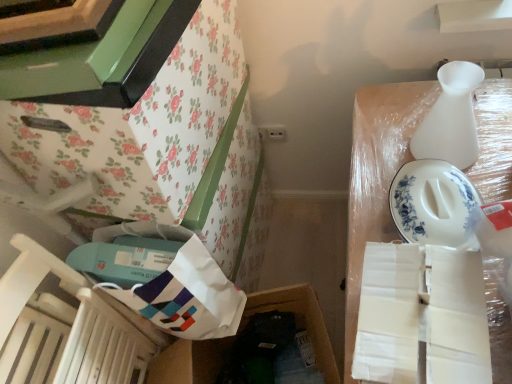
Question: Is white paper bag at lower left, which is counted as the 1th storage box, starting from the left, at the right side of floral paper-covered cabinet at upper left?

Choices:
 (A) yes
 (B) no

Answer: (A)

Question: Is floral paper-covered cabinet at upper left at the back of white paper bag at lower left, which is counted as the 1th storage box, starting from the left?

Choices:
 (A) yes
 (B) no

Answer: (B)

Question: Is white paper bag at lower left, the 2th storage box positioned from the right, not inside floral paper-covered cabinet at upper left?

Choices:
 (A) yes
 (B) no

Answer: (A)

Question: From a real-world perspective, is white paper bag at lower left, which is counted as the 1th storage box, starting from the left, on floral paper-covered cabinet at upper left?

Choices:
 (A) no
 (B) yes

Answer: (A)

Question: Is white paper bag at lower left, which is counted as the 1th storage box, starting from the left, far away from floral paper-covered cabinet at upper left?

Choices:
 (A) no
 (B) yes

Answer: (A)

Question: Can you confirm if white paper bag at lower left, which is counted as the 1th storage box, starting from the left, is thinner than floral paper-covered cabinet at upper left?

Choices:
 (A) yes
 (B) no

Answer: (B)

Question: Does wooden chair at lower left have a greater height compared to white matte vase at upper right?

Choices:
 (A) yes
 (B) no

Answer: (A)

Question: Is wooden chair at lower left smaller than white matte vase at upper right?

Choices:
 (A) no
 (B) yes

Answer: (A)

Question: Is wooden chair at lower left not close to white matte vase at upper right?

Choices:
 (A) yes
 (B) no

Answer: (B)

Question: Is white matte vase at upper right surrounded by wooden chair at lower left?

Choices:
 (A) no
 (B) yes

Answer: (A)

Question: From a real-world perspective, is wooden chair at lower left physically above white matte vase at upper right?

Choices:
 (A) yes
 (B) no

Answer: (B)

Question: Is wooden chair at lower left closer to the viewer compared to white matte vase at upper right?

Choices:
 (A) yes
 (B) no

Answer: (A)

Question: Is white cardboard box at upper right, which is counted as the 1th storage box, starting from the right, shorter than white matte vase at upper right?

Choices:
 (A) no
 (B) yes

Answer: (A)